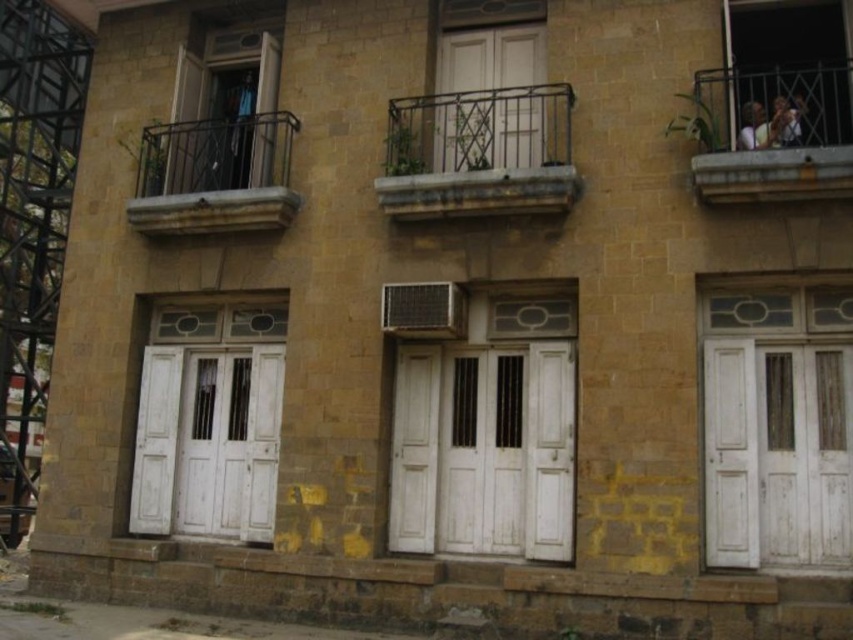
Consider the image. Does white wooden door at left have a greater width compared to matte glass door at upper left?

Yes.

Does white wooden door at left come in front of matte glass door at upper left?

Yes, it is in front of matte glass door at upper left.

Where is `white wooden door at left`? This screenshot has height=640, width=853. white wooden door at left is located at coordinates (209, 422).

Is metallic black balcony at upper right shorter than transparent glass window at upper right?

Incorrect, metallic black balcony at upper right's height does not fall short of transparent glass window at upper right's.

Describe the element at coordinates (775, 134) in the screenshot. I see `metallic black balcony at upper right` at that location.

This screenshot has width=853, height=640. Identify the location of metallic black balcony at upper right. (775, 134).

From the picture: Can you confirm if rustic metal balcony at upper left is thinner than transparent glass window at upper right?

No, rustic metal balcony at upper left is not thinner than transparent glass window at upper right.

Who is more distant from viewer, (175,211) or (799,44)?

Positioned behind is point (175,211).

Between point (247, 209) and point (753, 36), which one is positioned in front?

Point (753, 36) is in front.

The image size is (853, 640). Identify the location of rustic metal balcony at upper left. (215, 176).